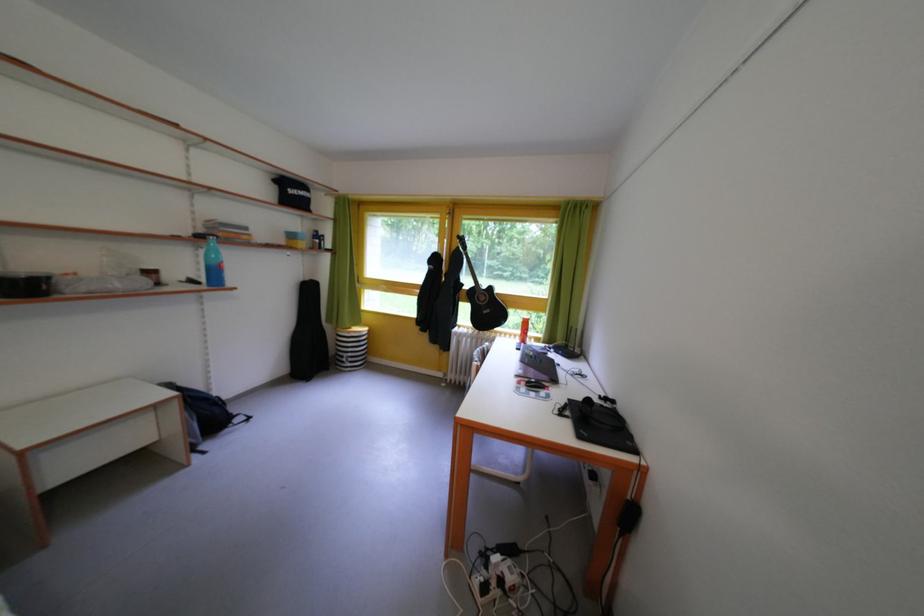
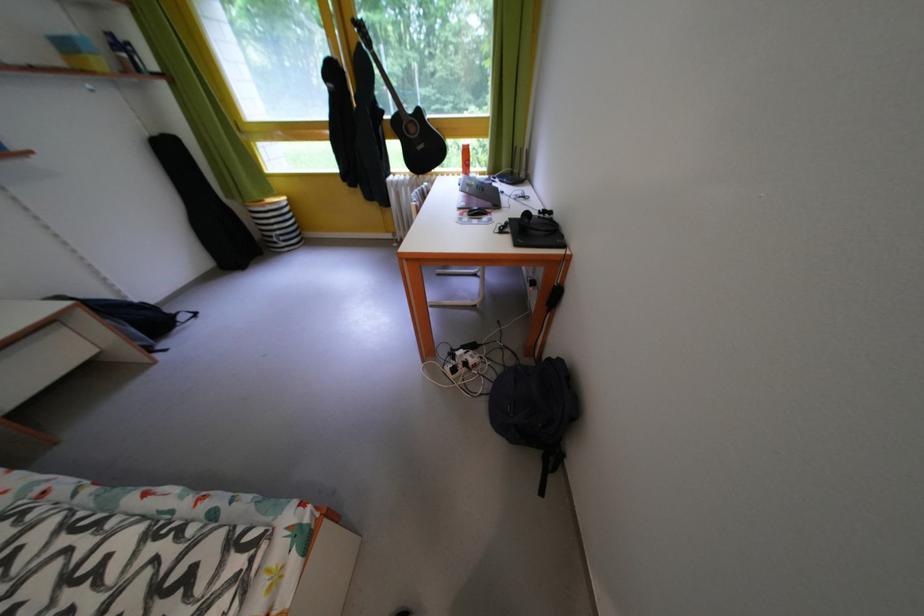
Find the pixel in the second image that matches pixel 525 322 in the first image.

(465, 153)